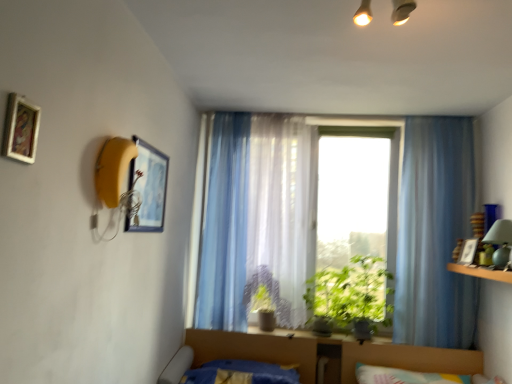
Question: Can you confirm if translucent fabric curtain at center, which is the 2th curtain from left to right, is bigger than green leafy plant at center, placed as the 2th plant when sorted from left to right?

Choices:
 (A) yes
 (B) no

Answer: (A)

Question: Considering the relative sizes of translucent fabric curtain at center, which is the 2th curtain from left to right, and green leafy plant at center, placed as the 2th plant when sorted from left to right, in the image provided, is translucent fabric curtain at center, which is the 2th curtain from left to right, smaller than green leafy plant at center, placed as the 2th plant when sorted from left to right,?

Choices:
 (A) no
 (B) yes

Answer: (A)

Question: Is translucent fabric curtain at center, acting as the 2th curtain starting from the right, wider than green leafy plant at center, the 1th plant in the right-to-left sequence?

Choices:
 (A) no
 (B) yes

Answer: (A)

Question: From a real-world perspective, does translucent fabric curtain at center, acting as the 2th curtain starting from the right, stand above green leafy plant at center, placed as the 2th plant when sorted from left to right?

Choices:
 (A) no
 (B) yes

Answer: (B)

Question: From the image's perspective, does translucent fabric curtain at center, which is the 2th curtain from left to right, appear lower than green leafy plant at center, placed as the 2th plant when sorted from left to right?

Choices:
 (A) yes
 (B) no

Answer: (B)

Question: Is translucent fabric curtain at center, which is the 2th curtain from left to right, not within green leafy plant at center, placed as the 2th plant when sorted from left to right?

Choices:
 (A) no
 (B) yes

Answer: (B)

Question: Is the surface of translucent fabric window at center in direct contact with translucent fabric curtain at center, acting as the 2th curtain starting from the right?

Choices:
 (A) no
 (B) yes

Answer: (A)

Question: Can you confirm if translucent fabric window at center is taller than translucent fabric curtain at center, acting as the 2th curtain starting from the right?

Choices:
 (A) yes
 (B) no

Answer: (B)

Question: Does translucent fabric window at center turn towards translucent fabric curtain at center, acting as the 2th curtain starting from the right?

Choices:
 (A) no
 (B) yes

Answer: (B)

Question: Is translucent fabric window at center further to the viewer compared to translucent fabric curtain at center, acting as the 2th curtain starting from the right?

Choices:
 (A) no
 (B) yes

Answer: (B)

Question: From the image's perspective, is translucent fabric window at center under translucent fabric curtain at center, which is the 2th curtain from left to right?

Choices:
 (A) yes
 (B) no

Answer: (A)

Question: From a real-world perspective, is translucent fabric window at center physically above translucent fabric curtain at center, acting as the 2th curtain starting from the right?

Choices:
 (A) yes
 (B) no

Answer: (B)

Question: Is wooden framed painting at upper left, placed as the 3th picture frame when sorted from back to front, located outside translucent fabric window at center?

Choices:
 (A) no
 (B) yes

Answer: (B)